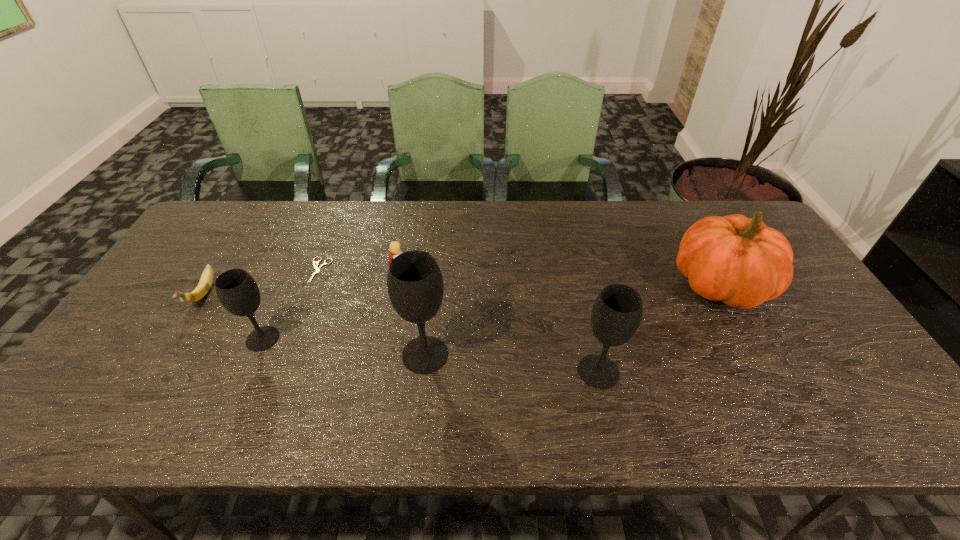
Find the location of a particular element. the fourth object from left to right is located at coordinates (394, 247).

Identify the location of Lego. (394, 247).

The image size is (960, 540). In order to click on free space located on the left of the second object from left to right in this screenshot , I will do `click(164, 339)`.

This screenshot has width=960, height=540. Find the location of `vacant area situated 0.400m on the left of the second wineglass from left to right`. vacant area situated 0.400m on the left of the second wineglass from left to right is located at coordinates (240, 354).

At what (x,y) coordinates should I click in order to perform the action: click on vacant area situated 0.220m on the back of the rightmost wineglass. Please return your answer as a coordinate pair (x, y). This screenshot has width=960, height=540. Looking at the image, I should click on (580, 291).

I want to click on vacant space situated on the front of the pumpkin, so click(756, 353).

Locate an element on the screen. This screenshot has height=540, width=960. free location located at the stem of the banana is located at coordinates (158, 366).

Identify the location of vacant space positioned 0.320m on the left of the shears. Image resolution: width=960 pixels, height=540 pixels. (202, 271).

Locate an element on the screen. free region located 0.290m on the front-facing side of the Lego is located at coordinates (510, 272).

This screenshot has height=540, width=960. I want to click on object located at the left edge, so click(201, 290).